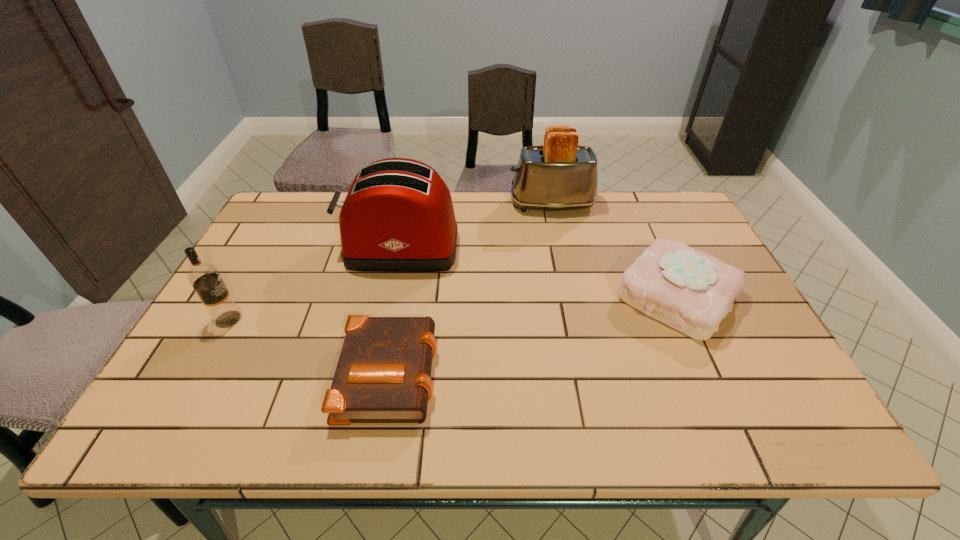
Identify the location of blank space at the far left corner of the desktop. (282, 192).

The image size is (960, 540). In the image, there is a desktop. What are the coordinates of `vacant region at the far right corner` in the screenshot? It's located at (678, 198).

The width and height of the screenshot is (960, 540). Find the location of `vacant space at the near right corner of the desktop`. vacant space at the near right corner of the desktop is located at coordinates (749, 407).

Identify the location of free area in between the left toaster and the farthest object. This screenshot has width=960, height=540. (476, 226).

You are a GUI agent. You are given a task and a screenshot of the screen. Output one action in this format:
    pyautogui.click(x=<x>, y=<y>)
    Task: Click on the vacant area between the left toaster and the farthest object
    
    Given the screenshot: What is the action you would take?
    click(x=476, y=226)

Where is `vacant region between the Bible and the fourth tallest object`? vacant region between the Bible and the fourth tallest object is located at coordinates (533, 334).

You are a GUI agent. You are given a task and a screenshot of the screen. Output one action in this format:
    pyautogui.click(x=<x>, y=<y>)
    Task: Click on the free space between the vodka and the cake
    The image size is (960, 540).
    Given the screenshot: What is the action you would take?
    pyautogui.click(x=452, y=308)

Find the location of a particular element. vacant area that lies between the vodka and the cake is located at coordinates (452, 308).

Where is `unoccupied position between the left toaster and the Bible`? The image size is (960, 540). unoccupied position between the left toaster and the Bible is located at coordinates (395, 309).

This screenshot has width=960, height=540. Find the location of `empty space between the leftmost object and the cake`. empty space between the leftmost object and the cake is located at coordinates (452, 308).